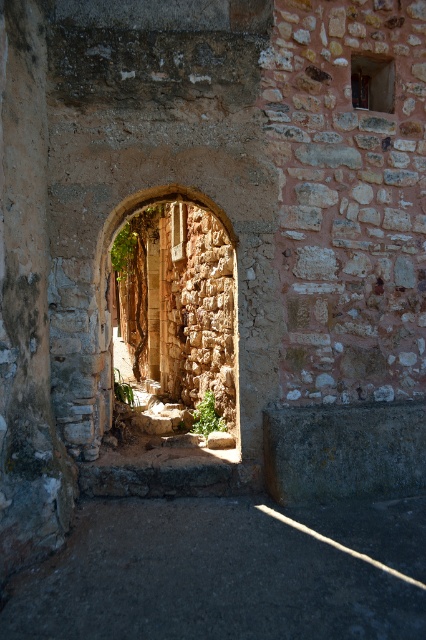
Does dark stone floor at lower center appear on the right side of rustic stone archway at center?

Correct, you'll find dark stone floor at lower center to the right of rustic stone archway at center.

Is point (242, 516) farther from camera compared to point (232, 307)?

No, it is not.

Image resolution: width=426 pixels, height=640 pixels. Identify the location of dark stone floor at lower center. (227, 573).